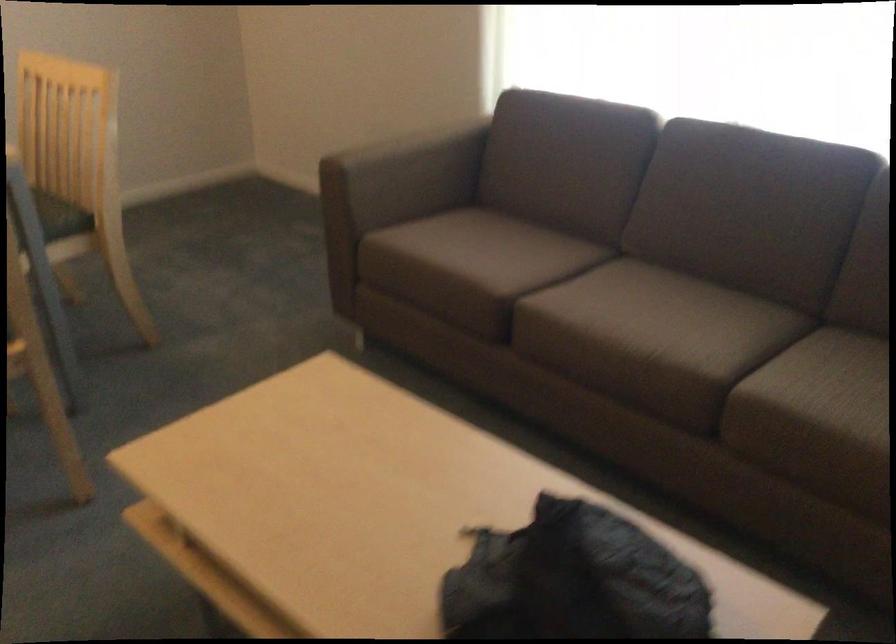
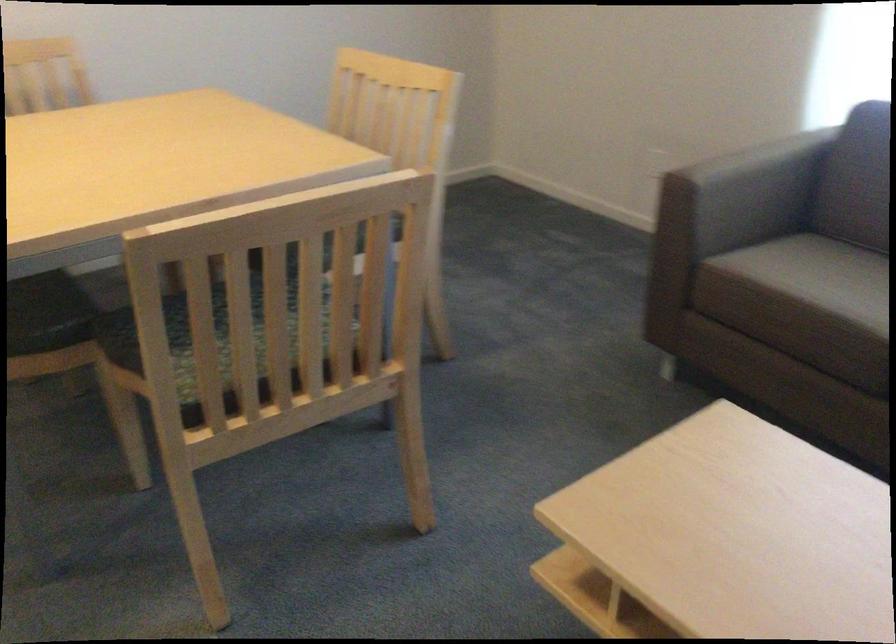
Question: The images are taken continuously from a first-person perspective. In which direction are you moving?

Choices:
 (A) Left
 (B) Right
 (C) Forward
 (D) Backward

Answer: (A)